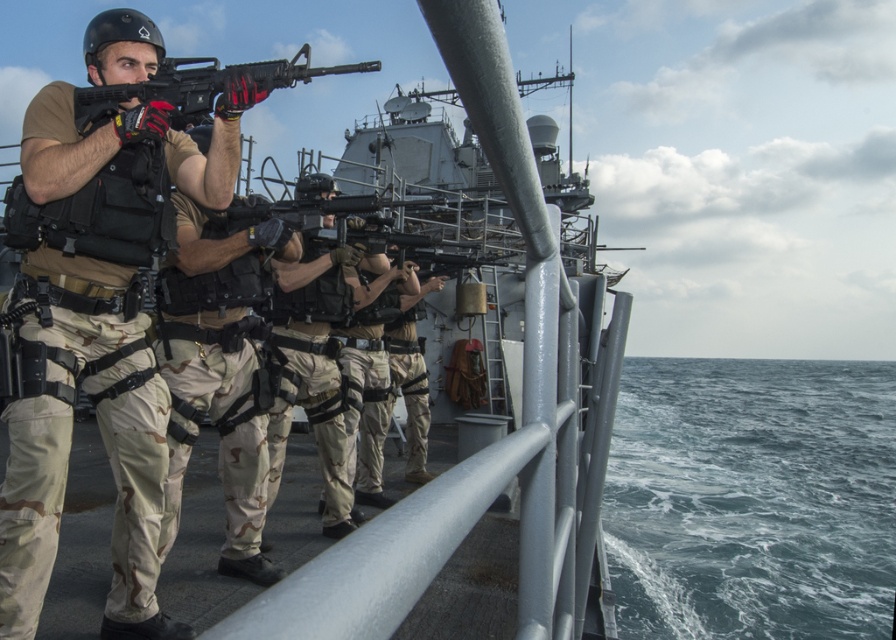
Who is taller, metallic gray boat at center or camouflage fabric uniform at center?

camouflage fabric uniform at center

Can you confirm if metallic gray boat at center is positioned below camouflage fabric uniform at center?

Yes, metallic gray boat at center is below camouflage fabric uniform at center.

Which is behind, point (564, 401) or point (317, 266)?

The point (317, 266) is more distant.

This screenshot has height=640, width=896. Find the location of `metallic gray boat at center`. metallic gray boat at center is located at coordinates (492, 444).

Does point (591, 458) come closer to viewer compared to point (278, 65)?

No, it is not.

Consider the image. Does metallic gray boat at center have a smaller size compared to matte black rifle at center?

Indeed, metallic gray boat at center has a smaller size compared to matte black rifle at center.

Is point (621, 308) behind point (213, 65)?

Yes, point (621, 308) is behind point (213, 65).

Where is `metallic gray boat at center`? metallic gray boat at center is located at coordinates (492, 444).

Does camouflage fabric pants at center appear over metallic gray boat at center?

Yes.

Does camouflage fabric pants at center come behind metallic gray boat at center?

No, camouflage fabric pants at center is in front of metallic gray boat at center.

Which is in front, point (127, 493) or point (550, 369)?

Point (550, 369)

Find the location of `camouflage fabric pants at center`. camouflage fabric pants at center is located at coordinates (97, 333).